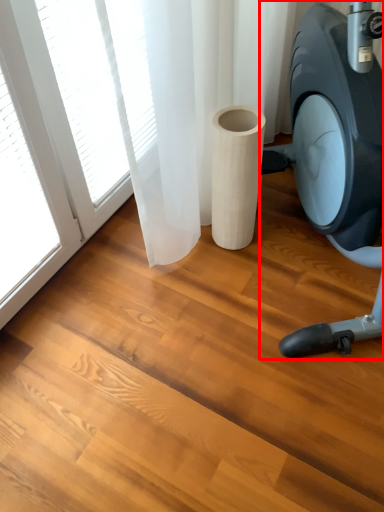
Question: Considering the relative positions of stationary bicycle (annotated by the red box) and paper towel in the image provided, where is stationary bicycle (annotated by the red box) located with respect to the staircase?

Choices:
 (A) left
 (B) right

Answer: (B)